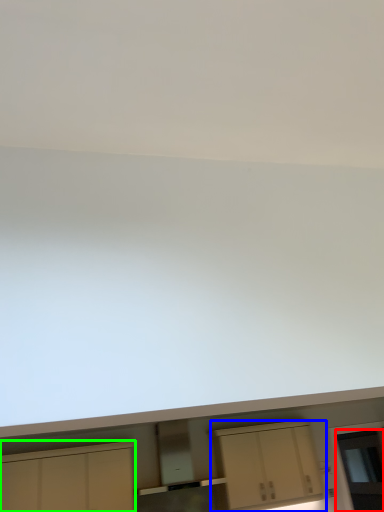
Question: Estimate the real-world distances between objects in this image. Which object is farther from glass door (highlighted by a red box), cabinetry (highlighted by a blue box) or cabinetry (highlighted by a green box)?

Choices:
 (A) cabinetry
 (B) cabinetry

Answer: (B)